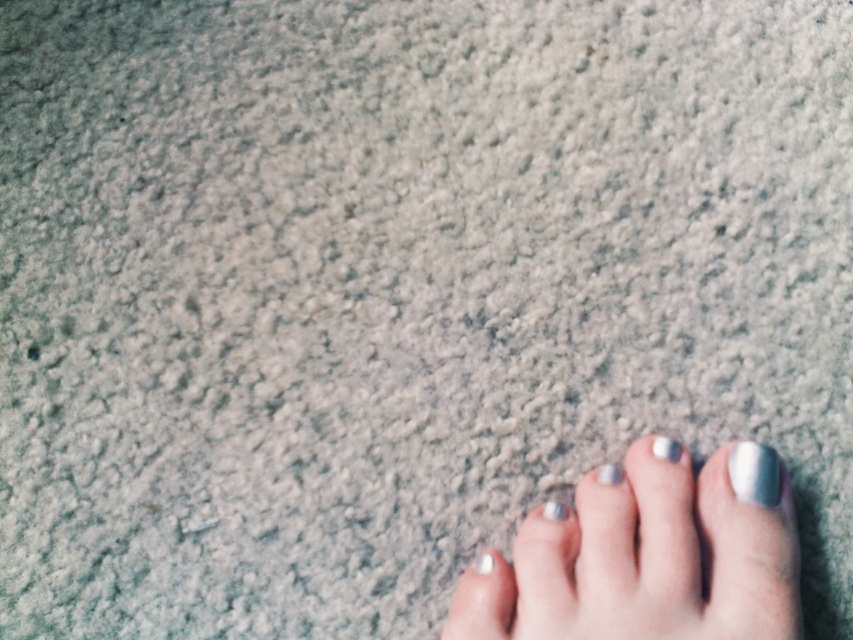
Question: Does silver metallic nail at center appear on the right side of silver metallic toe at lower right?

Choices:
 (A) no
 (B) yes

Answer: (B)

Question: Which point is closer to the camera?

Choices:
 (A) (480, 557)
 (B) (561, 516)
 (C) (599, 474)
 (D) (653, 589)

Answer: (D)

Question: Which point appears farthest from the camera in this image?

Choices:
 (A) (604, 472)
 (B) (486, 560)
 (C) (555, 518)

Answer: (A)

Question: Can you confirm if metallic silver nail polish at lower right is positioned to the right of silver metallic nail at center?

Choices:
 (A) yes
 (B) no

Answer: (B)

Question: Can you confirm if silver metallic nail at center is smaller than silver metallic toe at lower center?

Choices:
 (A) yes
 (B) no

Answer: (B)

Question: Which object is positioned farthest from the metallic silver nail polish at lower right?

Choices:
 (A) white glossy nail at lower right
 (B) silver metallic toe at lower right
 (C) silver metallic nail at center
 (D) silver metallic toe at lower center

Answer: (B)